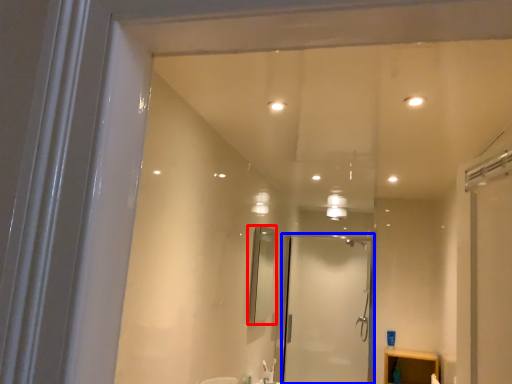
Question: Which of the following is the farthest to the observer, mirror (highlighted by a red box) or screen door (highlighted by a blue box)?

Choices:
 (A) mirror
 (B) screen door

Answer: (B)